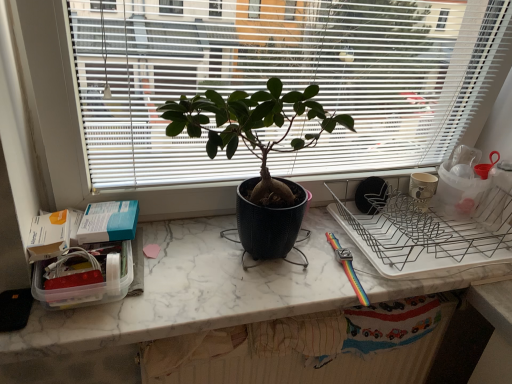
Question: Can you confirm if matte black pot at center is wider than white marble countertop at center?

Choices:
 (A) no
 (B) yes

Answer: (A)

Question: Does matte black pot at center lie in front of white marble countertop at center?

Choices:
 (A) yes
 (B) no

Answer: (A)

Question: Does matte black pot at center lie behind white marble countertop at center?

Choices:
 (A) yes
 (B) no

Answer: (B)

Question: Does matte black pot at center have a greater height compared to white marble countertop at center?

Choices:
 (A) yes
 (B) no

Answer: (A)

Question: Is matte black pot at center outside of white marble countertop at center?

Choices:
 (A) yes
 (B) no

Answer: (A)

Question: Is matte black pot at center turned away from white marble countertop at center?

Choices:
 (A) yes
 (B) no

Answer: (B)

Question: Does matte black plant at center appear on the right side of white marble countertop at center?

Choices:
 (A) no
 (B) yes

Answer: (A)

Question: Is matte black plant at center aimed at white marble countertop at center?

Choices:
 (A) no
 (B) yes

Answer: (A)

Question: Is the position of matte black plant at center more distant than that of white marble countertop at center?

Choices:
 (A) no
 (B) yes

Answer: (A)

Question: Is matte black plant at center smaller than white marble countertop at center?

Choices:
 (A) yes
 (B) no

Answer: (B)

Question: Can you confirm if matte black plant at center is positioned to the left of white marble countertop at center?

Choices:
 (A) yes
 (B) no

Answer: (A)

Question: Is matte black plant at center surrounding white marble countertop at center?

Choices:
 (A) no
 (B) yes

Answer: (A)

Question: Considering the relative sizes of matte black plant at center and matte black pot at center in the image provided, is matte black plant at center smaller than matte black pot at center?

Choices:
 (A) yes
 (B) no

Answer: (B)